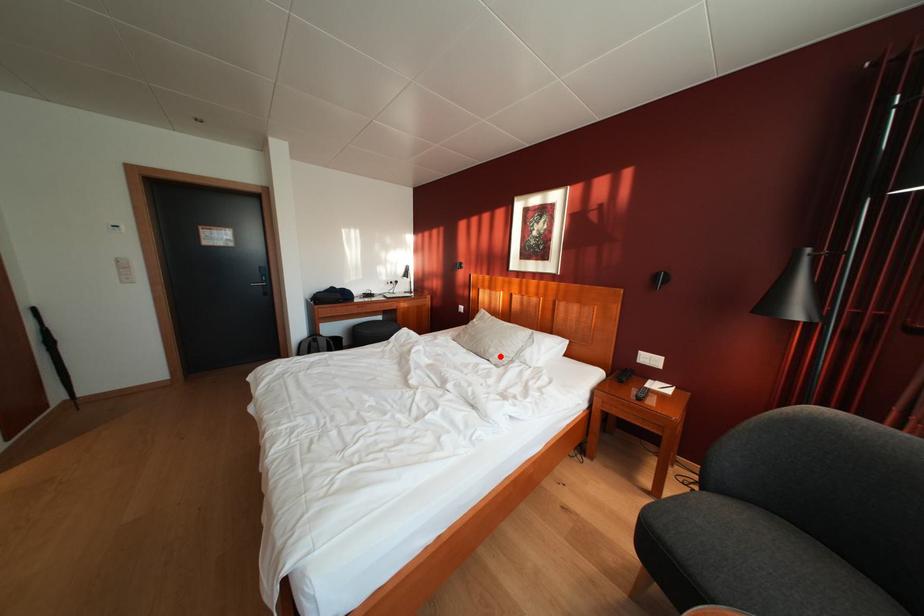
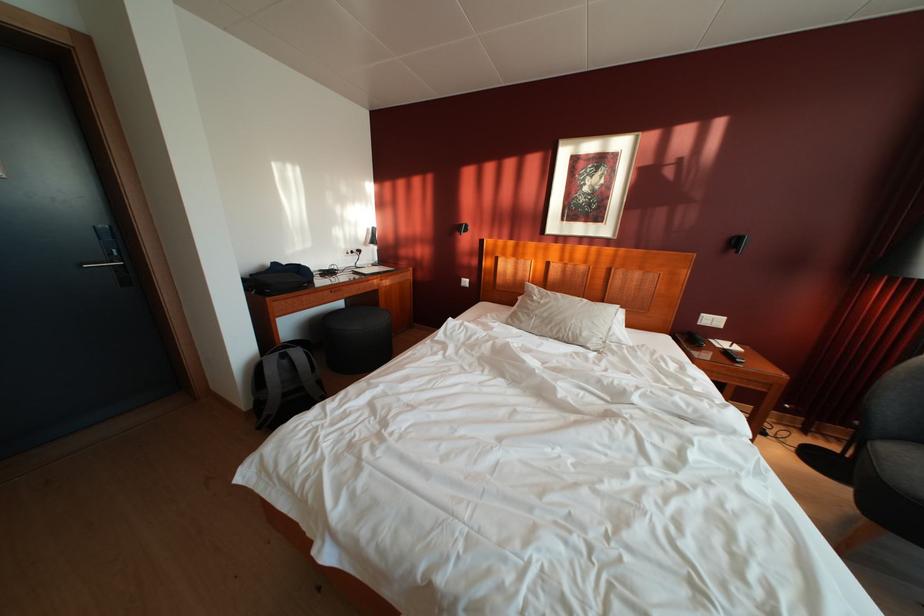
In the second image, find the point that corresponds to the highlighted location in the first image.

(593, 339)